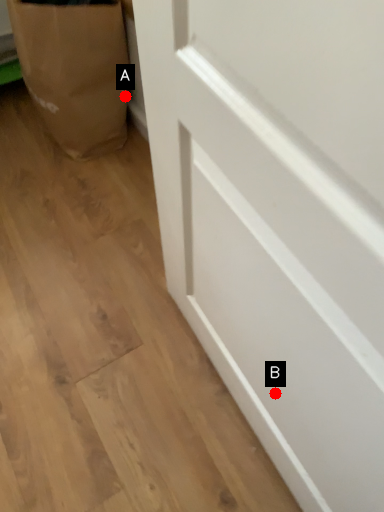
Question: Two points are circled on the image, labeled by A and B beside each circle. Which of the following is the closest to the observer?

Choices:
 (A) A is closer
 (B) B is closer

Answer: (B)